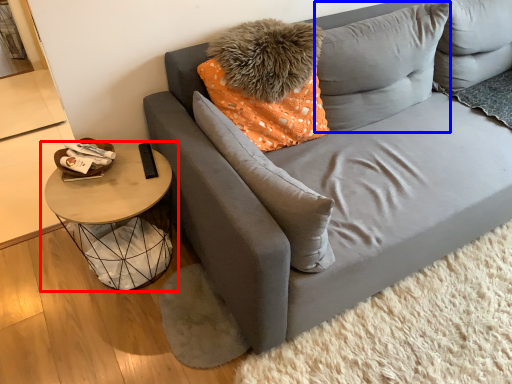
Question: Which object is further to the camera taking this photo, table (highlighted by a red box) or pillow (highlighted by a blue box)?

Choices:
 (A) table
 (B) pillow

Answer: (B)